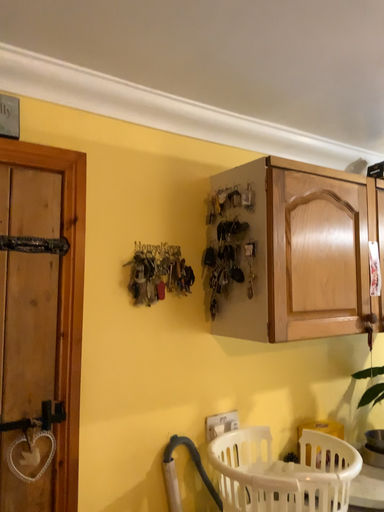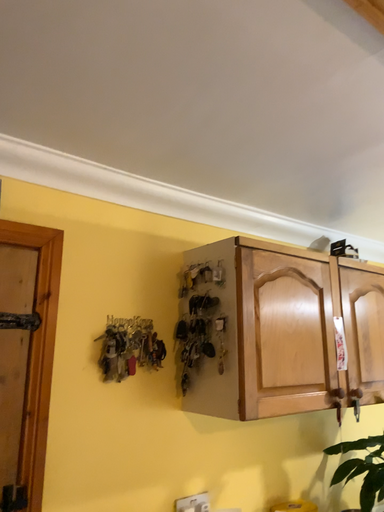
Question: Which way did the camera rotate in the video?

Choices:
 (A) rotated downward
 (B) rotated upward

Answer: (B)